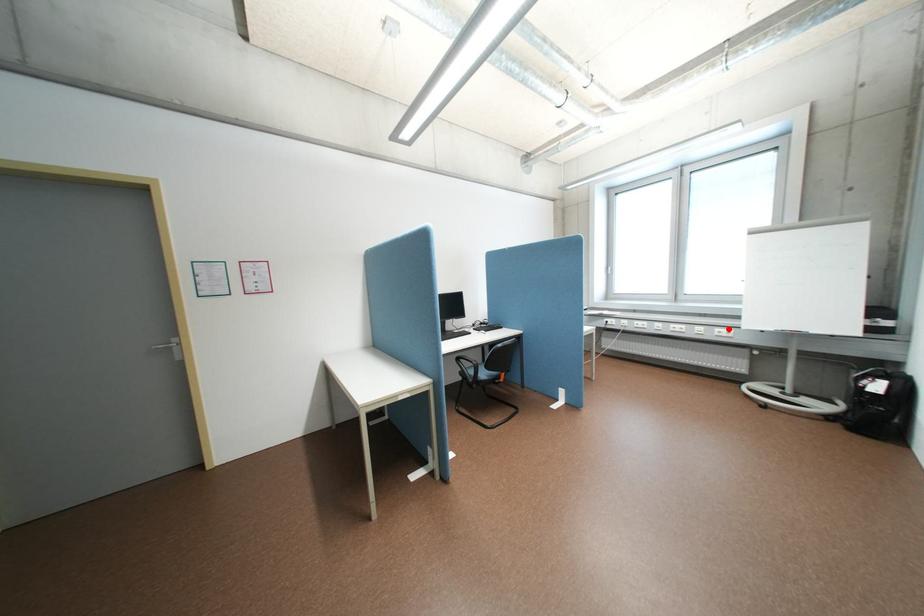
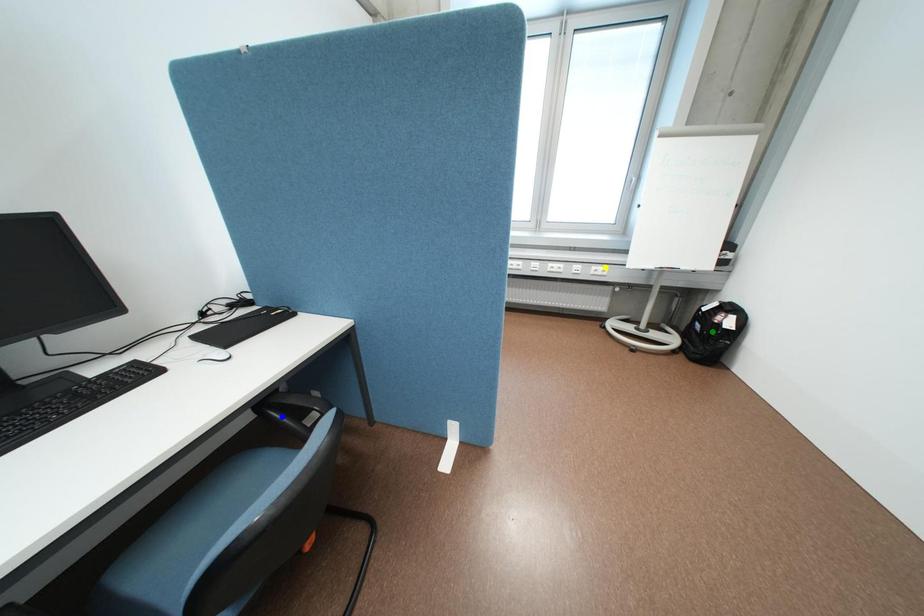
Question: I am providing you with two images of the same scene from different viewpoints. A red point is marked on the first image. You are given multiple points on the second image. Which mark in image 2 goes with the point in image 1?

Choices:
 (A) blue point
 (B) green point
 (C) yellow point

Answer: (C)